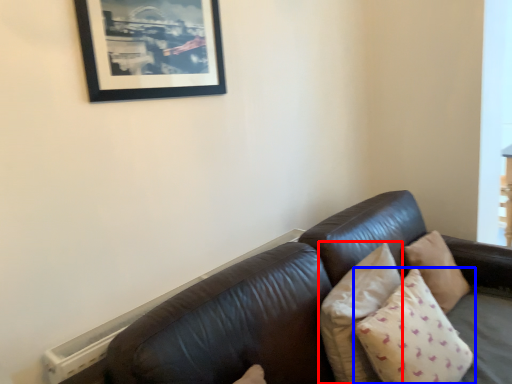
Question: Which object appears farthest to the camera in this image, pillow (highlighted by a red box) or pillow (highlighted by a blue box)?

Choices:
 (A) pillow
 (B) pillow

Answer: (A)